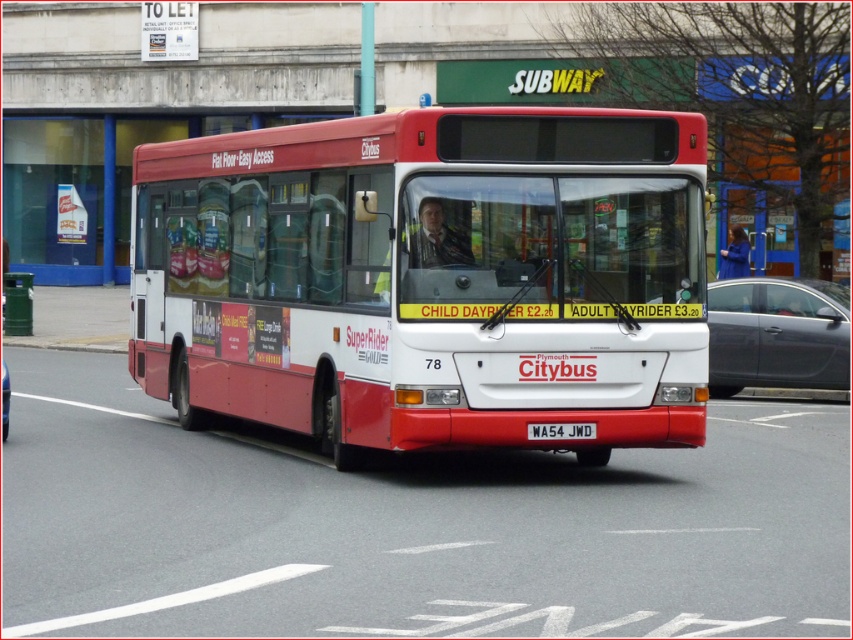
Question: Does white metallic license plate at center have a larger size compared to metallic gray car at center?

Choices:
 (A) yes
 (B) no

Answer: (B)

Question: Where is matte red bus at center located in relation to white metallic license plate at center in the image?

Choices:
 (A) above
 (B) below

Answer: (A)

Question: Estimate the real-world distances between objects in this image. Which object is closer to the matte red bus at center?

Choices:
 (A) metallic gray sedan at center
 (B) metallic gray car at center
 (C) white metallic license plate at center

Answer: (C)

Question: Which point appears farthest from the camera in this image?

Choices:
 (A) (4, 417)
 (B) (747, 355)

Answer: (B)

Question: Can you confirm if metallic gray sedan at center is smaller than metallic gray car at center?

Choices:
 (A) no
 (B) yes

Answer: (A)

Question: Which point appears farthest from the camera in this image?

Choices:
 (A) (538, 390)
 (B) (798, 365)
 (C) (3, 433)

Answer: (B)